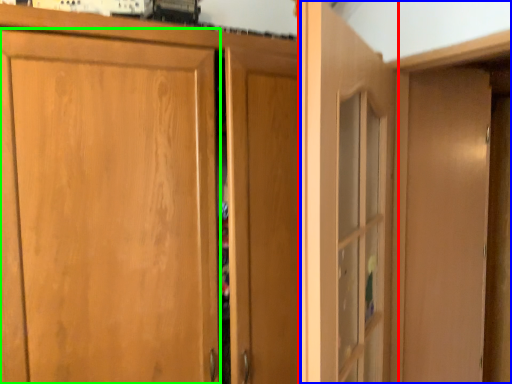
Question: Based on their relative distances, which object is nearer to door (highlighted by a red box)? Choose from dresser (highlighted by a blue box) and door (highlighted by a green box).

Choices:
 (A) dresser
 (B) door

Answer: (A)